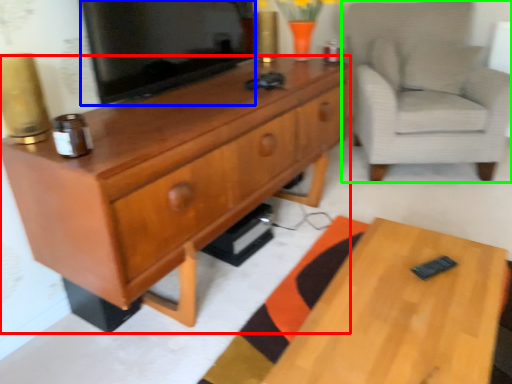
Question: Which is farther away from cabinetry (highlighted by a red box)? television (highlighted by a blue box) or chair (highlighted by a green box)?

Choices:
 (A) television
 (B) chair

Answer: (B)